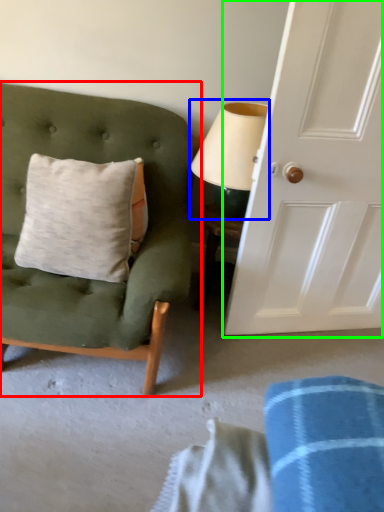
Question: Estimate the real-world distances between objects in this image. Which object is closer to chair (highlighted by a red box), table lamp (highlighted by a blue box) or door (highlighted by a green box)?

Choices:
 (A) table lamp
 (B) door

Answer: (A)